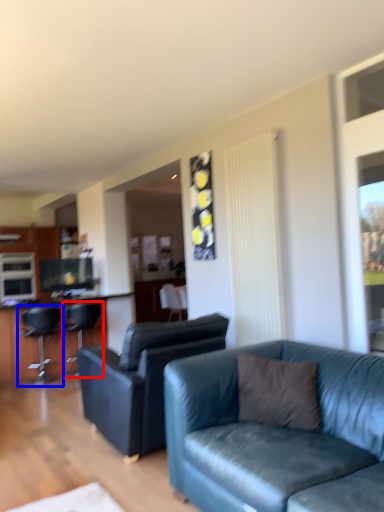
Question: Among these objects, which one is farthest to the camera, chair (highlighted by a red box) or chair (highlighted by a blue box)?

Choices:
 (A) chair
 (B) chair

Answer: (A)